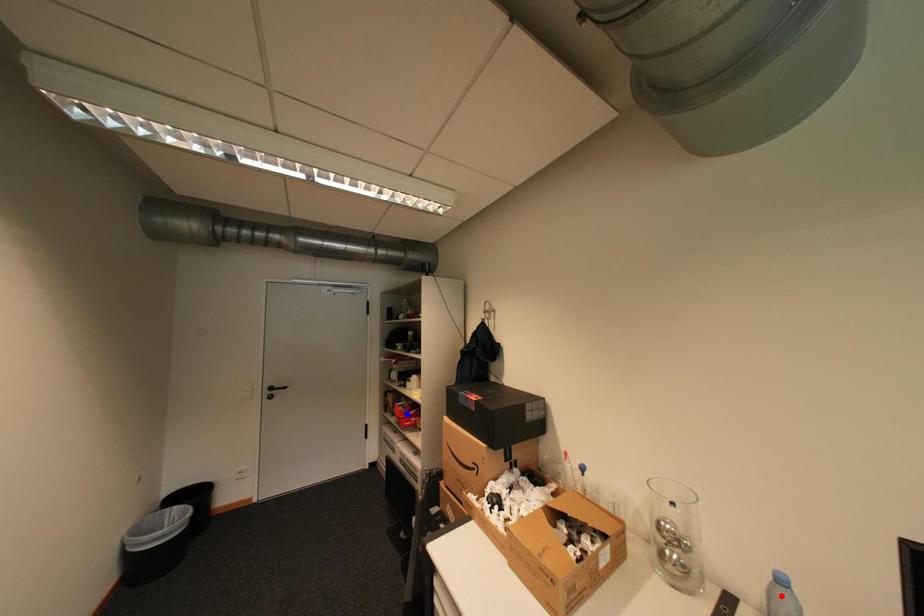
Question: Two points are marked on the image. Which point is closer to the camera?

Choices:
 (A) Blue point is closer.
 (B) Red point is closer.

Answer: (B)